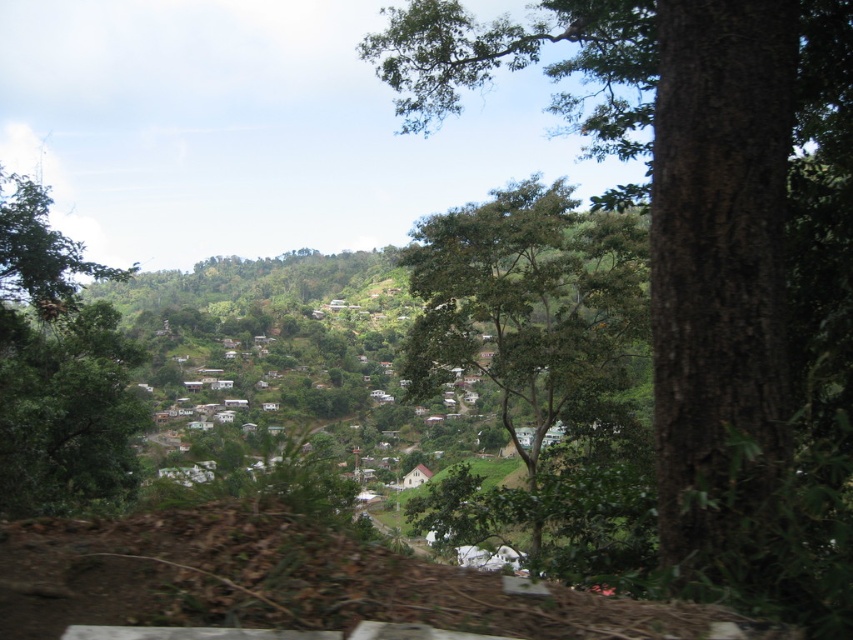
You are a hiker who wants to take a photo of the village from a spot where both the green leafy tree at center and the green leafy tree at left are visible. Which tree should you position yourself closer to in order to ensure both are in the frame?

You should position yourself closer to the green leafy tree at left because the green leafy tree at center is larger, so being closer to the smaller tree ensures both fit within the camera frame.

You are an observer standing in the scenic hilly landscape. You notice two green leafy trees, one at the center and one at the left. Which tree is closer to you, the green leafy tree at center or the green leafy tree at left?

The green leafy tree at center is positioned under the green leafy tree at left, meaning the tree at the left is closer to you.